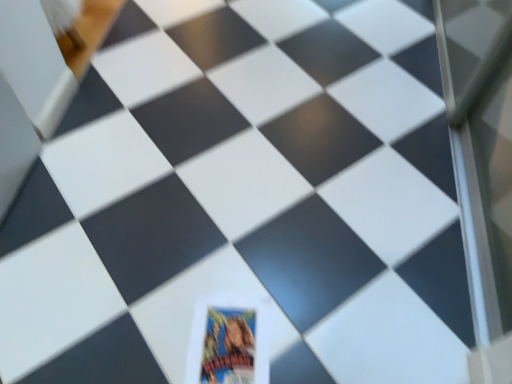
Where is `vacant space behind colorful glossy comic book at center`? The height and width of the screenshot is (384, 512). vacant space behind colorful glossy comic book at center is located at coordinates tap(237, 259).